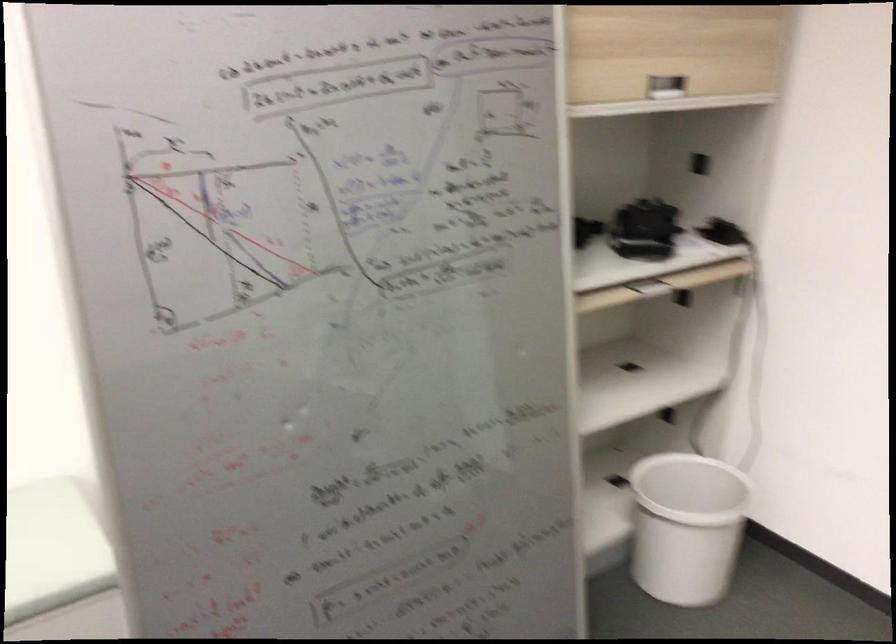
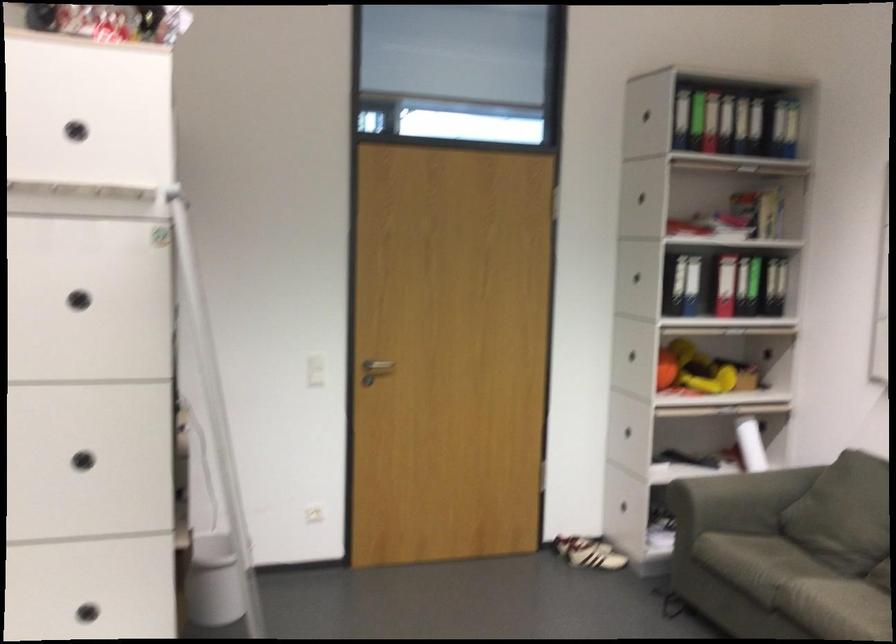
Question: I am providing you with two images of the same scene from different viewpoints. After the viewpoint changes to image2, which objects are now occluded?

Choices:
 (A) recessed cabinet handle
 (B) blue metal cylinder
 (C) black binder
 (D) black circular handle

Answer: (A)